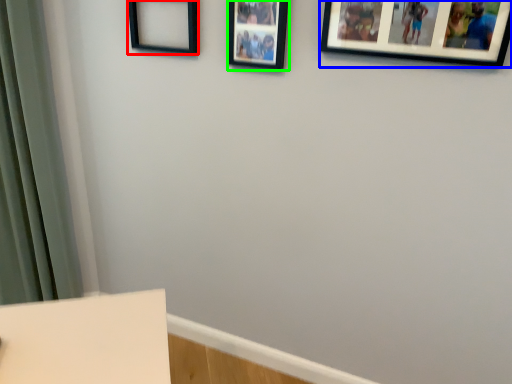
Question: Estimate the real-world distances between objects in this image. Which object is closer to picture frame (highlighted by a red box), picture frame (highlighted by a blue box) or picture frame (highlighted by a green box)?

Choices:
 (A) picture frame
 (B) picture frame

Answer: (B)